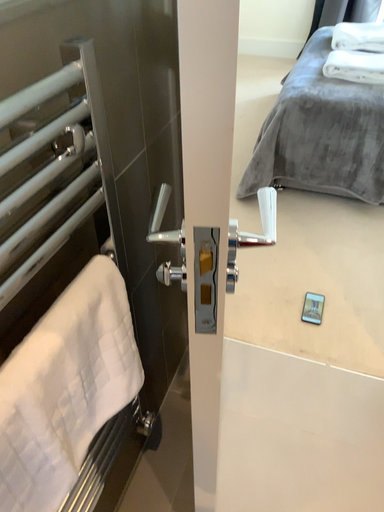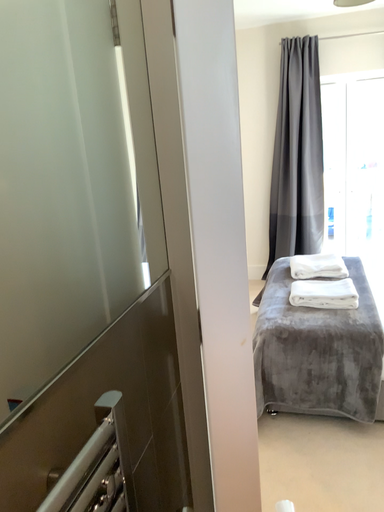
Question: How did the camera likely rotate when shooting the video?

Choices:
 (A) rotated downward
 (B) rotated upward

Answer: (B)